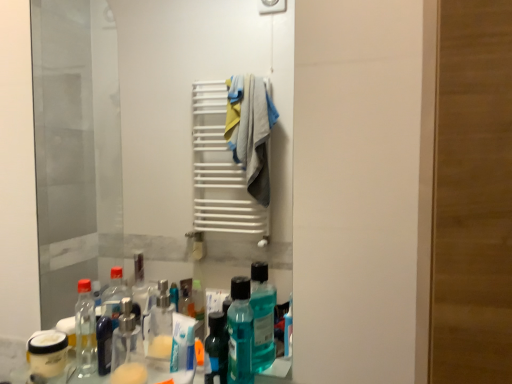
Question: Which direction should I rotate to look at translucent plastic mouthwash at lower center?

Choices:
 (A) right
 (B) left

Answer: (B)

Question: From a real-world perspective, is transparent glass mirror at center below translucent plastic mouthwash at lower center?

Choices:
 (A) no
 (B) yes

Answer: (A)

Question: Is transparent glass mirror at center smaller than translucent plastic mouthwash at lower center?

Choices:
 (A) no
 (B) yes

Answer: (A)

Question: Is transparent glass mirror at center oriented towards translucent plastic mouthwash at lower center?

Choices:
 (A) yes
 (B) no

Answer: (A)

Question: Is the depth of transparent glass mirror at center greater than that of translucent plastic mouthwash at lower center?

Choices:
 (A) yes
 (B) no

Answer: (A)

Question: Would you say transparent glass mirror at center is a long distance from translucent plastic mouthwash at lower center?

Choices:
 (A) yes
 (B) no

Answer: (A)

Question: Is transparent glass mirror at center surrounding translucent plastic mouthwash at lower center?

Choices:
 (A) no
 (B) yes

Answer: (A)

Question: Is translucent plastic mouthwash at lower center far away from transparent glass mirror at center?

Choices:
 (A) yes
 (B) no

Answer: (A)

Question: Is translucent plastic mouthwash at lower center smaller than transparent glass mirror at center?

Choices:
 (A) yes
 (B) no

Answer: (A)

Question: Considering the relative sizes of translucent plastic mouthwash at lower center and transparent glass mirror at center in the image provided, is translucent plastic mouthwash at lower center thinner than transparent glass mirror at center?

Choices:
 (A) no
 (B) yes

Answer: (A)

Question: From the image's perspective, is translucent plastic mouthwash at lower center located above transparent glass mirror at center?

Choices:
 (A) yes
 (B) no

Answer: (B)

Question: Is translucent plastic mouthwash at lower center outside of transparent glass mirror at center?

Choices:
 (A) no
 (B) yes

Answer: (B)

Question: From a real-world perspective, is translucent plastic mouthwash at lower center located higher than transparent glass mirror at center?

Choices:
 (A) yes
 (B) no

Answer: (B)

Question: Is point (49, 188) positioned closer to the camera than point (234, 299)?

Choices:
 (A) closer
 (B) farther

Answer: (B)